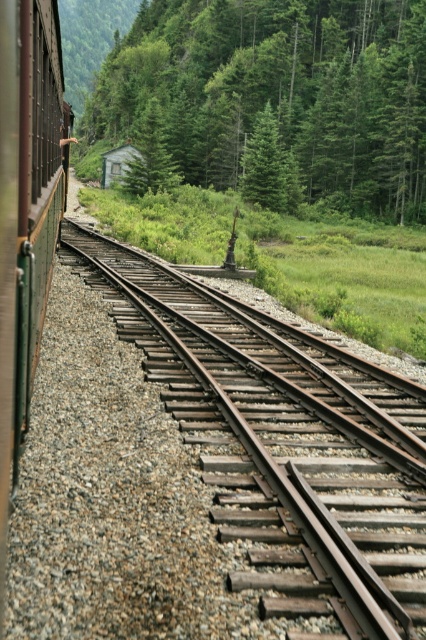
You are a passenger sitting inside the train and looking out through the green glass window at left. You notice a green leafy tree at center outside. Based on their sizes, which object appears closer to you?

The green leafy tree at center appears closer to you because it is larger in size than the green glass window at left, indicating proximity due to perspective.

You are a passenger sitting inside the train and looking out. You notice the rusty metal train track at center and the green glass window at left. Which object is wider from your viewpoint?

The rusty metal train track at center is wider than the green glass window at left according to the description.